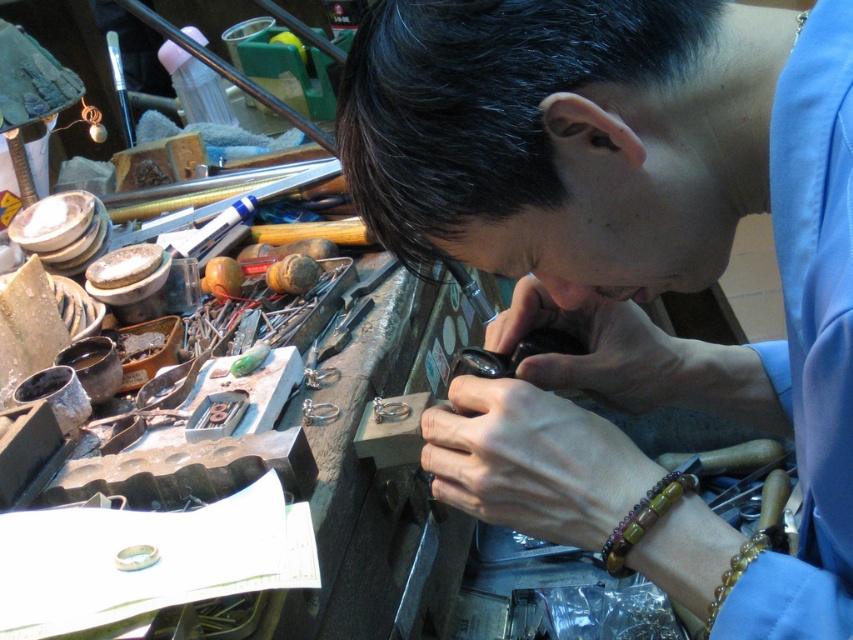
Based on the photo, does multicolored wood beads at lower right appear under brown polished bracelet at lower right?

No.

Find the location of `multicolored wood beads at lower right`. multicolored wood beads at lower right is located at coordinates (647, 515).

Does matte gold ring at center appear under brown polished bracelet at lower right?

Actually, matte gold ring at center is above brown polished bracelet at lower right.

Which is in front, point (549, 422) or point (764, 538)?

Point (764, 538) is in front.

I want to click on matte gold ring at center, so click(624, 246).

Based on the photo, does matte gold ring at center have a greater height compared to smooth skin hand at center?

Indeed, matte gold ring at center has a greater height compared to smooth skin hand at center.

Does matte gold ring at center appear on the right side of smooth skin hand at center?

Indeed, matte gold ring at center is positioned on the right side of smooth skin hand at center.

At what (x,y) coordinates should I click in order to perform the action: click on matte gold ring at center. Please return your answer as a coordinate pair (x, y). Looking at the image, I should click on (624, 246).

In order to click on matte gold ring at center in this screenshot , I will do pyautogui.click(x=624, y=246).